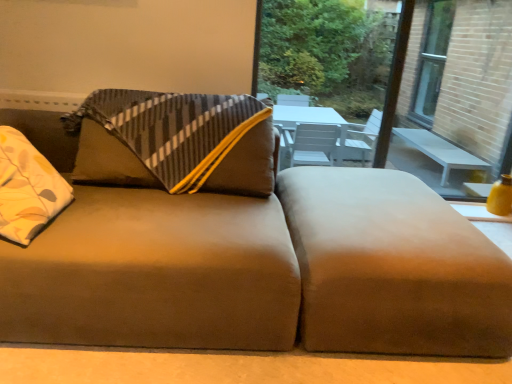
This screenshot has width=512, height=384. Describe the element at coordinates (247, 246) in the screenshot. I see `suede brown couch at center` at that location.

What do you see at coordinates (326, 51) in the screenshot? I see `transparent glass window at upper right` at bounding box center [326, 51].

Identify the location of suede brown couch at center. (247, 246).

From the picture: From a real-world perspective, is suede-like brown footrest at lower right over suede brown couch at center?

Actually, suede-like brown footrest at lower right is physically below suede brown couch at center in the real world.

Is suede-like brown footrest at lower right located outside suede brown couch at center?

suede-like brown footrest at lower right is positioned outside suede brown couch at center.

Based on the photo, is suede brown couch at center at the back of suede-like brown footrest at lower right?

That's not correct — suede-like brown footrest at lower right is not looking away from suede brown couch at center.

Is suede brown couch at center taller than transparent glass window at upper right?

No, suede brown couch at center is not taller than transparent glass window at upper right.

How different are the orientations of suede brown couch at center and transparent glass window at upper right in degrees?

There is a 0.147-degree angle between the facing directions of suede brown couch at center and transparent glass window at upper right.

From the image's perspective, which is below, suede brown couch at center or transparent glass window at upper right?

suede brown couch at center.

Is transparent glass window at upper right located within suede brown couch at center?

No, transparent glass window at upper right is located outside of suede brown couch at center.

Considering the relative sizes of suede-like brown footrest at lower right and transparent glass window at upper right in the image provided, is suede-like brown footrest at lower right wider than transparent glass window at upper right?

Correct, the width of suede-like brown footrest at lower right exceeds that of transparent glass window at upper right.

Considering the sizes of objects suede-like brown footrest at lower right and transparent glass window at upper right in the image provided, who is bigger, suede-like brown footrest at lower right or transparent glass window at upper right?

suede-like brown footrest at lower right.

From a real-world perspective, between suede-like brown footrest at lower right and transparent glass window at upper right, who is vertically higher?

transparent glass window at upper right, from a real-world perspective.

Can you see suede brown couch at center touching suede-like brown footrest at lower right?

No, suede brown couch at center is not with suede-like brown footrest at lower right.

Is suede brown couch at center not within suede-like brown footrest at lower right?

Yes.

Considering the sizes of objects transparent glass window at upper right and suede-like brown footrest at lower right in the image provided, who is smaller, transparent glass window at upper right or suede-like brown footrest at lower right?

With smaller size is transparent glass window at upper right.

Is transparent glass window at upper right beside suede-like brown footrest at lower right?

No, transparent glass window at upper right is not in contact with suede-like brown footrest at lower right.

Does point (339, 24) lie behind point (382, 193)?

Yes, point (339, 24) is behind point (382, 193).

Does transparent glass window at upper right turn towards suede-like brown footrest at lower right?

Yes, transparent glass window at upper right is aimed at suede-like brown footrest at lower right.

From a real-world perspective, is transparent glass window at upper right physically located above or below suede brown couch at center?

transparent glass window at upper right is above suede brown couch at center.

From the image's perspective, between transparent glass window at upper right and suede brown couch at center, who is located below?

From the image's view, suede brown couch at center is below.

Is transparent glass window at upper right directly adjacent to suede brown couch at center?

transparent glass window at upper right is not next to suede brown couch at center, and they're not touching.

You are a GUI agent. You are given a task and a screenshot of the screen. Output one action in this format:
    pyautogui.click(x=<x>, y=<y>)
    Task: Click on the footrest on the right of the suede brown couch at center
    
    Given the screenshot: What is the action you would take?
    (393, 267)

This screenshot has width=512, height=384. There is a suede brown couch at center. Find the location of `window screen above it (from a real-world perspective)`. window screen above it (from a real-world perspective) is located at coordinates (326, 51).

Based on their spatial positions, is suede-like brown footrest at lower right or suede brown couch at center closer to transparent glass window at upper right?

Among the two, suede brown couch at center is located nearer to transparent glass window at upper right.

Which object lies further to the anchor point suede brown couch at center, suede-like brown footrest at lower right or transparent glass window at upper right?

The object further to suede brown couch at center is transparent glass window at upper right.

From the image, which object appears to be farther from suede-like brown footrest at lower right, suede brown couch at center or transparent glass window at upper right?

transparent glass window at upper right lies further to suede-like brown footrest at lower right than the other object.

Estimate the real-world distances between objects in this image. Which object is further from transparent glass window at upper right, suede brown couch at center or suede-like brown footrest at lower right?

suede-like brown footrest at lower right is positioned further to the anchor transparent glass window at upper right.

Which object lies nearer to the anchor point suede-like brown footrest at lower right, transparent glass window at upper right or suede brown couch at center?

suede brown couch at center lies closer to suede-like brown footrest at lower right than the other object.

Looking at the image, which one is located further to suede brown couch at center, transparent glass window at upper right or suede-like brown footrest at lower right?

transparent glass window at upper right is further to suede brown couch at center.

At what (x,y) coordinates should I click in order to perform the action: click on footrest between suede brown couch at center and transparent glass window at upper right in the front-back direction. Please return your answer as a coordinate pair (x, y). Image resolution: width=512 pixels, height=384 pixels. Looking at the image, I should click on (393, 267).